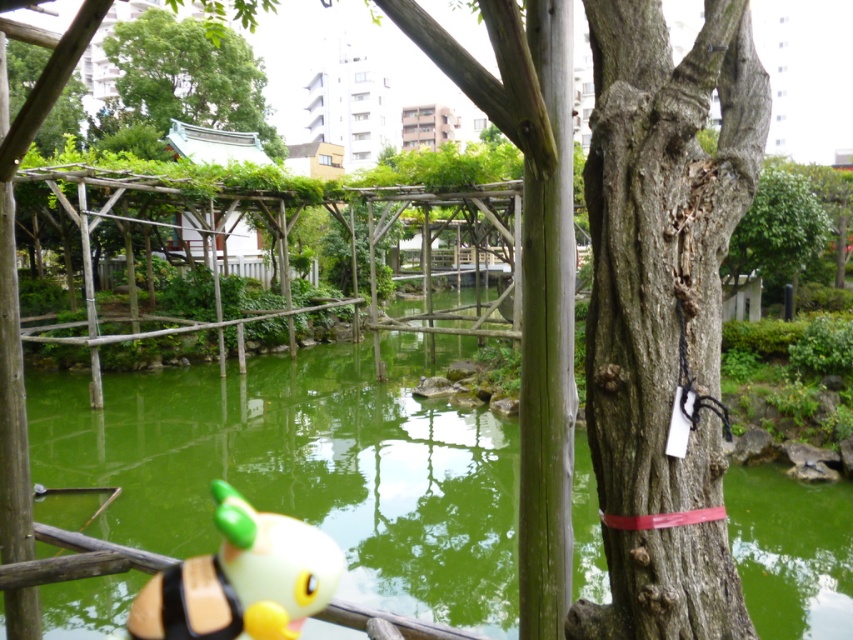
Does yellow matte toy at lower left have a smaller size compared to green leafy tree at upper left?

Yes, yellow matte toy at lower left is smaller than green leafy tree at upper left.

I want to click on yellow matte toy at lower left, so click(241, 579).

Is green liquid water at center closer to the viewer compared to gray rough bark tree trunk at center?

That is False.

Is point (140, 518) more distant than point (642, 154)?

Yes, it is.

At what (x,y) coordinates should I click in order to perform the action: click on green liquid water at center. Please return your answer as a coordinate pair (x, y). The width and height of the screenshot is (853, 640). Looking at the image, I should click on (305, 468).

Can you confirm if smooth wooden pole at center is positioned above yellow matte toy at lower left?

Yes.

Can you confirm if smooth wooden pole at center is taller than yellow matte toy at lower left?

Indeed, smooth wooden pole at center has a greater height compared to yellow matte toy at lower left.

Between point (538, 17) and point (172, 618), which one is positioned in front?

Positioned in front is point (538, 17).

Identify the location of smooth wooden pole at center. The height and width of the screenshot is (640, 853). (547, 340).